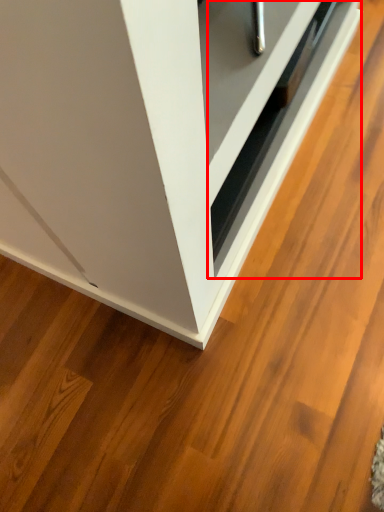
Question: From the image, what is the correct spatial relationship of drawer (annotated by the red box) in relation to cabinetry?

Choices:
 (A) left
 (B) right

Answer: (B)